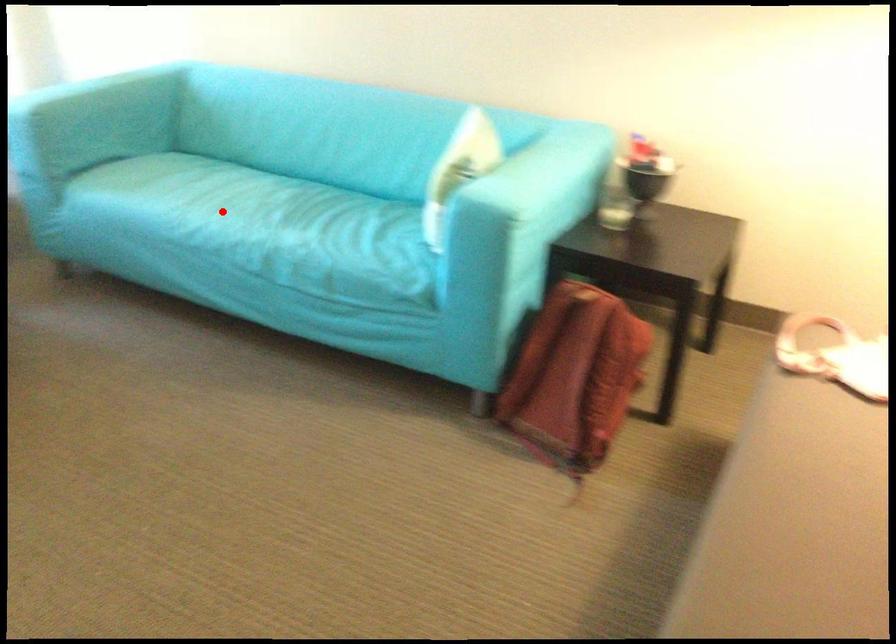
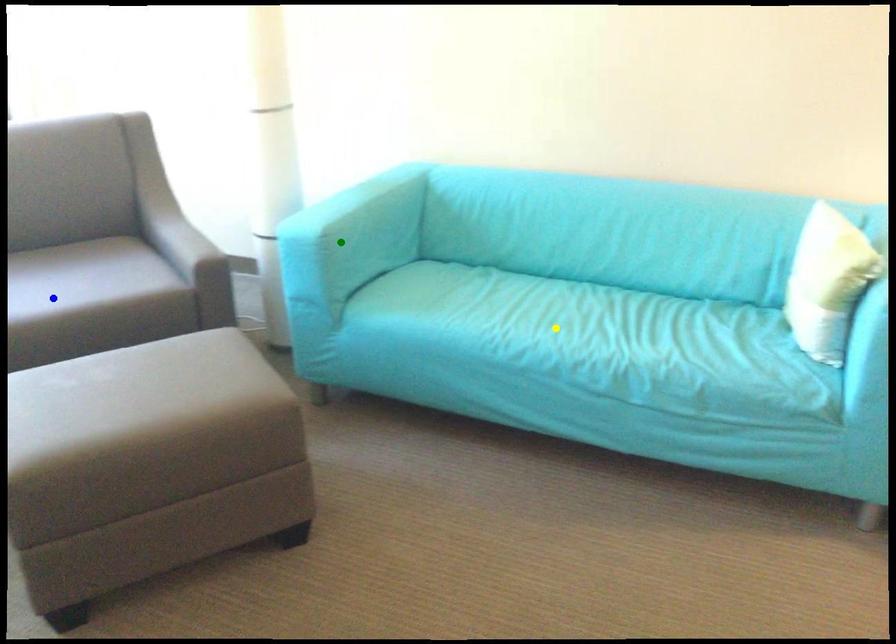
Question: I am providing you with two images of the same scene from different viewpoints. A red point is marked on the first image. You are given multiple points on the second image. Which spot in image 2 lines up with the point in image 1?

Choices:
 (A) green point
 (B) yellow point
 (C) blue point

Answer: (B)